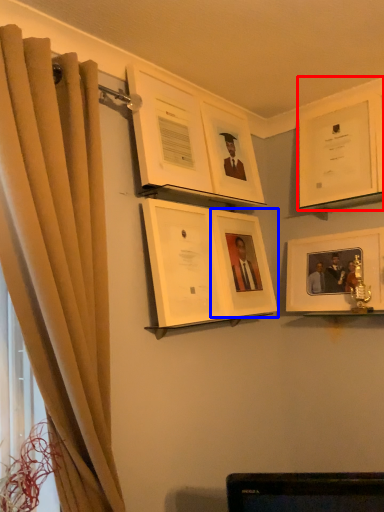
Question: Among these objects, which one is farthest to the camera, picture frame (highlighted by a red box) or picture frame (highlighted by a blue box)?

Choices:
 (A) picture frame
 (B) picture frame

Answer: (A)